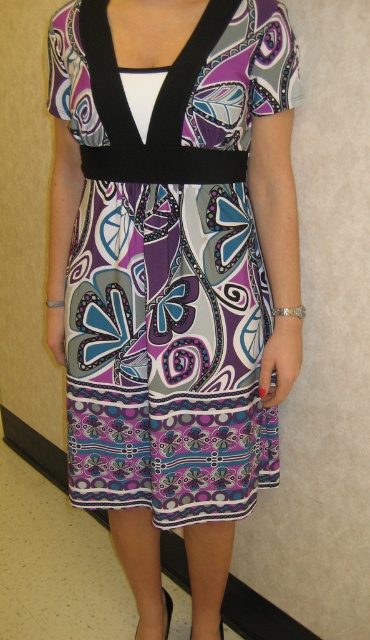
Which of these two, purple printed dress at center or matte black sandal at lower center, stands shorter?

matte black sandal at lower center

Does purple printed dress at center have a greater height compared to matte black sandal at lower center?

Indeed, purple printed dress at center has a greater height compared to matte black sandal at lower center.

What do you see at coordinates (169, 264) in the screenshot?
I see `purple printed dress at center` at bounding box center [169, 264].

Where is `purple printed dress at center`? The width and height of the screenshot is (370, 640). purple printed dress at center is located at coordinates (169, 264).

Can you confirm if matte black sandal at lower center is positioned to the right of black leather sandal at lower center?

In fact, matte black sandal at lower center is to the left of black leather sandal at lower center.

Which is more to the left, matte black sandal at lower center or black leather sandal at lower center?

matte black sandal at lower center is more to the left.

Which is in front, point (166, 595) or point (220, 624)?

Point (220, 624)

Where is `matte black sandal at lower center`? The image size is (370, 640). matte black sandal at lower center is located at coordinates (167, 611).

You are a GUI agent. You are given a task and a screenshot of the screen. Output one action in this format:
    pyautogui.click(x=<x>, y=<y>)
    Task: Click on the purple printed dress at center
    This screenshot has height=640, width=370.
    Given the screenshot: What is the action you would take?
    pyautogui.click(x=169, y=264)

At what (x,y) coordinates should I click in order to perform the action: click on purple printed dress at center. Please return your answer as a coordinate pair (x, y). This screenshot has height=640, width=370. Looking at the image, I should click on (169, 264).